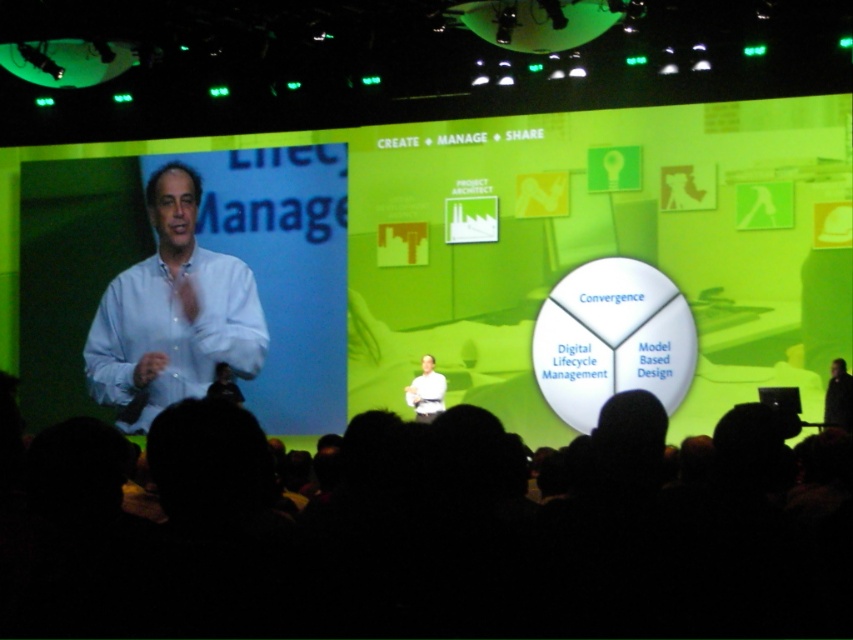
You are an attendee at the presentation and want to take a photo of the speaker. The black fabric at lower center and the light blue shirt at left are both in the frame. Which object will appear wider in the photo?

The black fabric at lower center will appear wider in the photo since its width is larger than the light blue shirt at left.